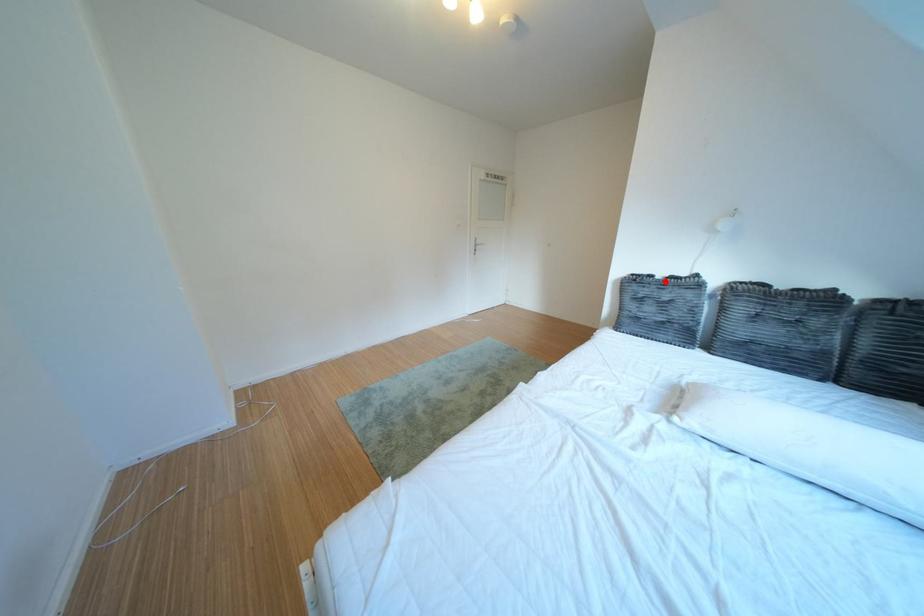
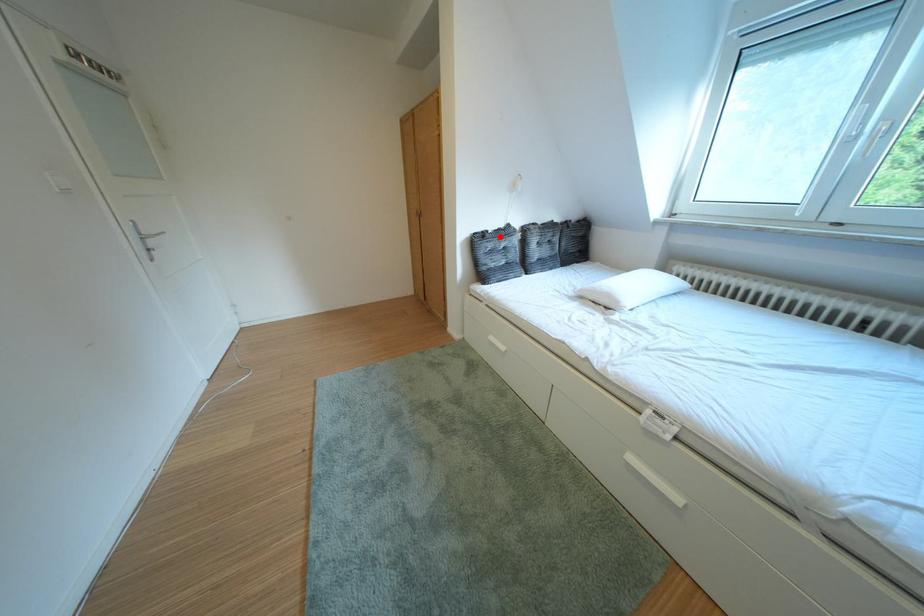
I am providing you with two images of the same scene from different viewpoints. A red point is marked on the first image and another point is marked on the second image. Is the red point in image1 aligned with the point shown in image2?

Yes